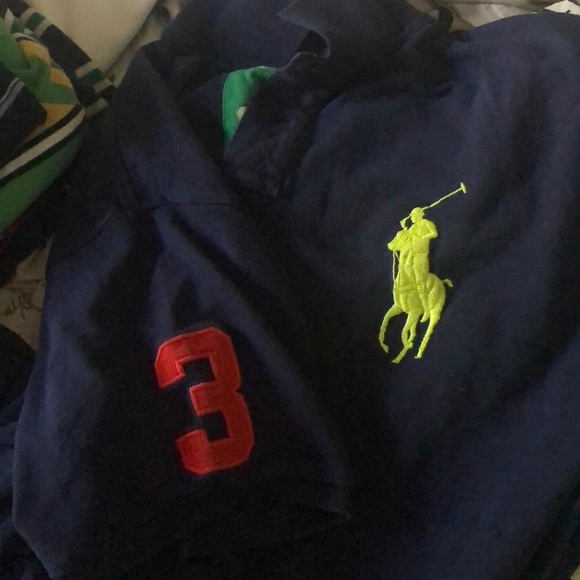
At what (x,y) coordinates should I click in order to perform the action: click on cloth surface. Please return your answer as a coordinate pair (x, y). Looking at the image, I should click on (26, 307).